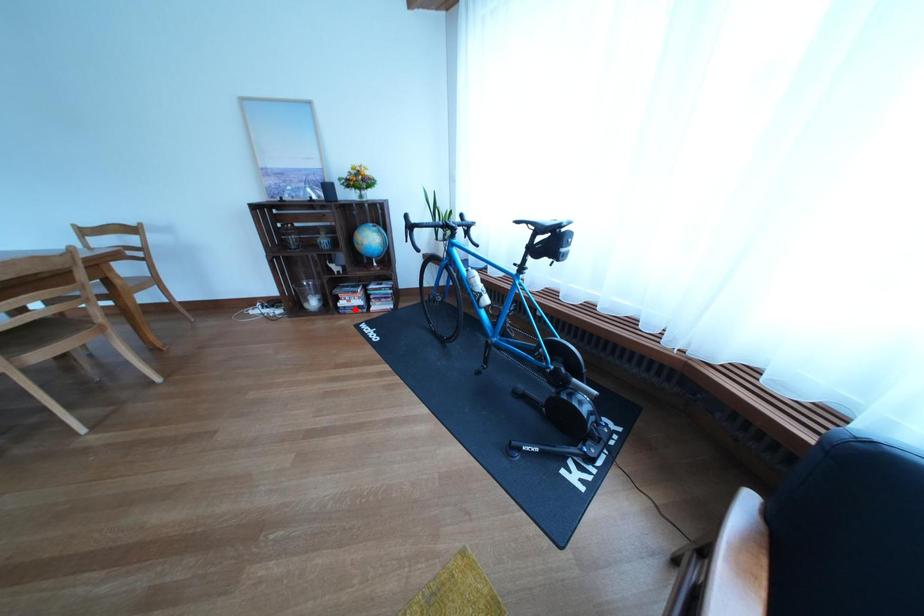
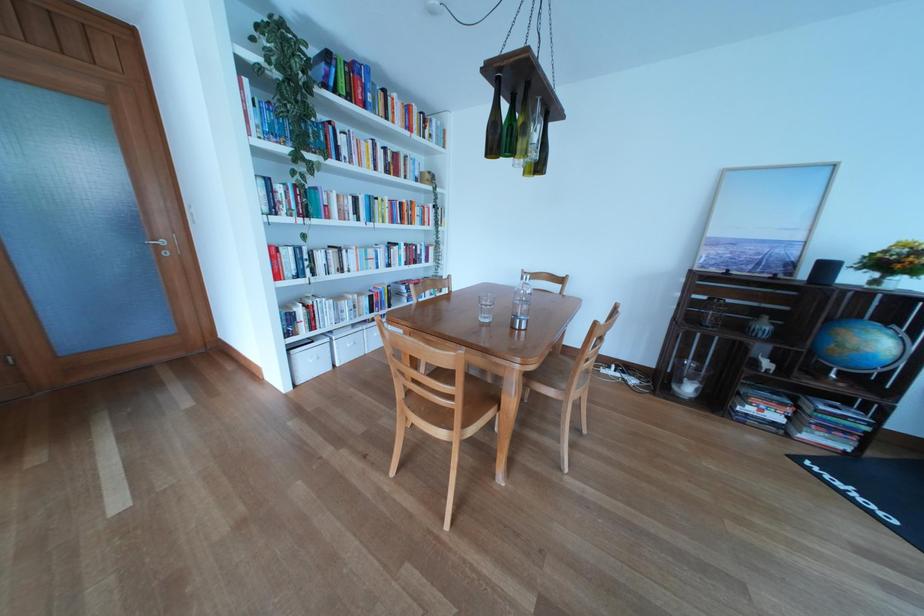
Where in the second image is the point corresponding to the highlighted location from the first image?

(762, 416)